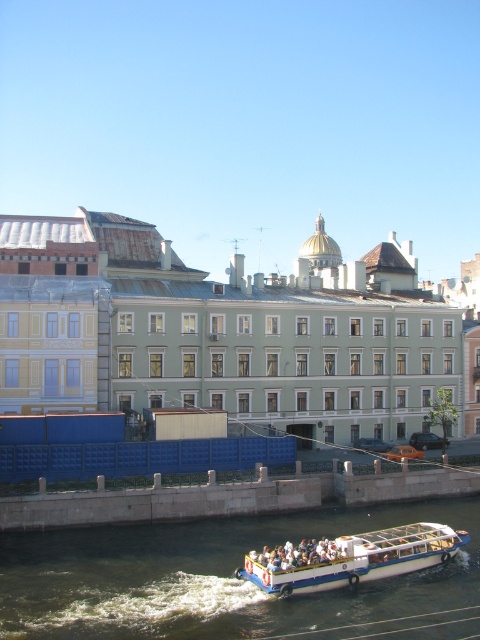
Question: Where is dark blue water at center located in relation to white plastic boat at lower center in the image?

Choices:
 (A) right
 (B) left

Answer: (B)

Question: Which point is farther to the camera?

Choices:
 (A) white plastic boat at lower center
 (B) dark blue water at center

Answer: (A)

Question: Which object is closer to the camera taking this photo?

Choices:
 (A) white plastic boat at lower center
 (B) dark blue water at center

Answer: (B)

Question: Is dark blue water at center above white plastic boat at lower center?

Choices:
 (A) no
 (B) yes

Answer: (A)

Question: Can you confirm if dark blue water at center is positioned below white plastic boat at lower center?

Choices:
 (A) yes
 (B) no

Answer: (A)

Question: Which point is closer to the camera?

Choices:
 (A) white plastic boat at lower center
 (B) dark blue water at center

Answer: (B)